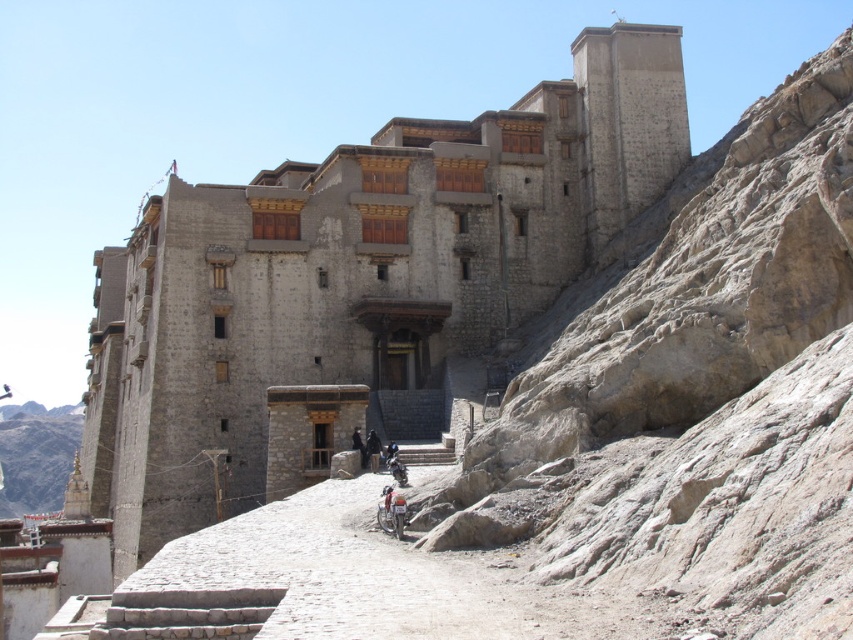
You are a tour guide explaining the historical site to visitors. You point out the white stone stupa at lower left and the shiny metallic motorcycle at center. Which object is wider according to the description?

The white stone stupa at lower left might be wider than the shiny metallic motorcycle at center according to the description.

In the scene shown: You are a tour guide explaining the historical site to visitors. You notice two motorcycles parked at the center of the area. Which one is larger in size between the metallic silver motorcycle at center and the shiny metallic motorcycle at center?

The metallic silver motorcycle at center is bigger than the shiny metallic motorcycle at center according to the description.

You are standing at the base of the hill where the white stone stupa at lower left is located. If you want to walk towards the gray stone building at center, which direction should you face?

You should face to the right since the gray stone building at center is to the right of the white stone stupa at lower left.